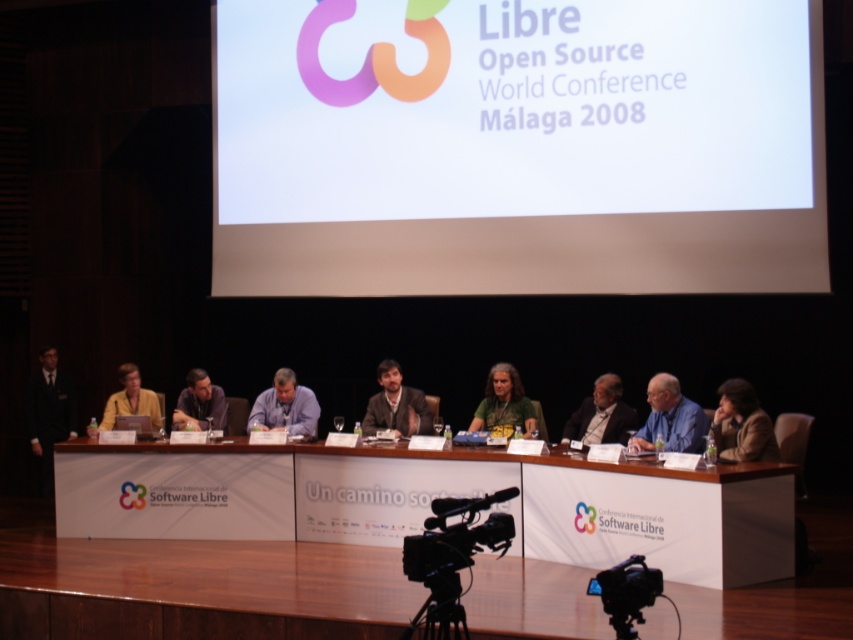
What is located at the coordinates point (741, 424) in the image?

The point (741, 424) is on the brown leather jacket at lower right.

You are an attendee at the conference and want to take a photo of the white paper at upper center and the matte black projector at center. Which object should you focus on first if you want to capture both in the same frame without moving your camera?

The white paper at upper center is bigger than the matte black projector at center, so you should focus on the white paper at upper center first to ensure it fits properly in the frame before adjusting for the smaller projector.

Based on the photo, you are an attendee at the Libre Open Source World Conference in M?laga 2008. You notice the white paper at upper center and the matte black projector at center. Which object is positioned higher in the image?

The white paper at upper center is located above the matte black projector at center, so it is positioned higher in the image.